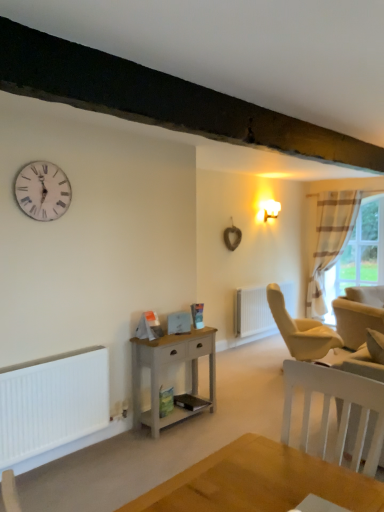
Question: From a real-world perspective, is striped fabric curtain at right located higher than plaid fabric curtain at right?

Choices:
 (A) yes
 (B) no

Answer: (B)

Question: Considering the relative sizes of striped fabric curtain at right and plaid fabric curtain at right in the image provided, is striped fabric curtain at right wider than plaid fabric curtain at right?

Choices:
 (A) yes
 (B) no

Answer: (B)

Question: Is striped fabric curtain at right at the left side of plaid fabric curtain at right?

Choices:
 (A) no
 (B) yes

Answer: (A)

Question: From a real-world perspective, is striped fabric curtain at right under plaid fabric curtain at right?

Choices:
 (A) no
 (B) yes

Answer: (B)

Question: From the image's perspective, is striped fabric curtain at right under plaid fabric curtain at right?

Choices:
 (A) yes
 (B) no

Answer: (A)

Question: From a real-world perspective, is white matte radiator at center positioned above or below white matte heater at lower left?

Choices:
 (A) below
 (B) above

Answer: (A)

Question: Is white matte radiator at center in front of or behind white matte heater at lower left in the image?

Choices:
 (A) behind
 (B) front

Answer: (A)

Question: Is point (243, 294) closer or farther from the camera than point (9, 435)?

Choices:
 (A) closer
 (B) farther

Answer: (B)

Question: Considering the relative positions of white matte radiator at center and white matte heater at lower left in the image provided, is white matte radiator at center to the left or to the right of white matte heater at lower left?

Choices:
 (A) right
 (B) left

Answer: (A)

Question: From the image's perspective, is white wooden clock at upper left positioned above or below matte gold wall sconce at upper right?

Choices:
 (A) above
 (B) below

Answer: (B)

Question: Relative to matte gold wall sconce at upper right, is white wooden clock at upper left in front or behind?

Choices:
 (A) front
 (B) behind

Answer: (A)

Question: Is white wooden clock at upper left wider or thinner than matte gold wall sconce at upper right?

Choices:
 (A) wide
 (B) thin

Answer: (B)

Question: Based on their sizes in the image, would you say white wooden clock at upper left is bigger or smaller than matte gold wall sconce at upper right?

Choices:
 (A) big
 (B) small

Answer: (B)

Question: Based on their positions, is white wooden clock at upper left located to the left or right of white matte radiator at center?

Choices:
 (A) left
 (B) right

Answer: (A)

Question: Based on their sizes in the image, would you say white wooden clock at upper left is bigger or smaller than white matte radiator at center?

Choices:
 (A) small
 (B) big

Answer: (A)